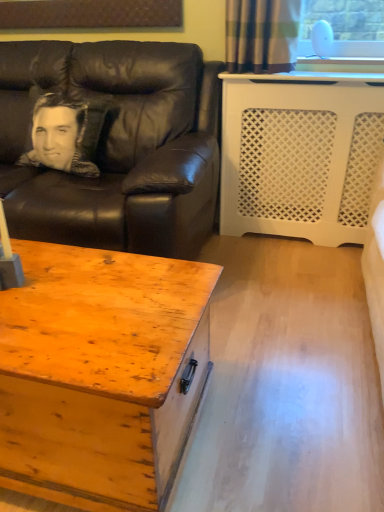
Question: From a real-world perspective, is wooden chest at lower left physically located above or below silky black pillow at left?

Choices:
 (A) below
 (B) above

Answer: (A)

Question: Is wooden chest at lower left to the left or to the right of silky black pillow at left in the image?

Choices:
 (A) right
 (B) left

Answer: (A)

Question: Based on their relative distances, which object is nearer to the wooden chest at lower left?

Choices:
 (A) silky black pillow at left
 (B) black leather couch at left

Answer: (B)

Question: Which of these objects is positioned farthest from the silky black pillow at left?

Choices:
 (A) black leather couch at left
 (B) wooden chest at lower left

Answer: (B)